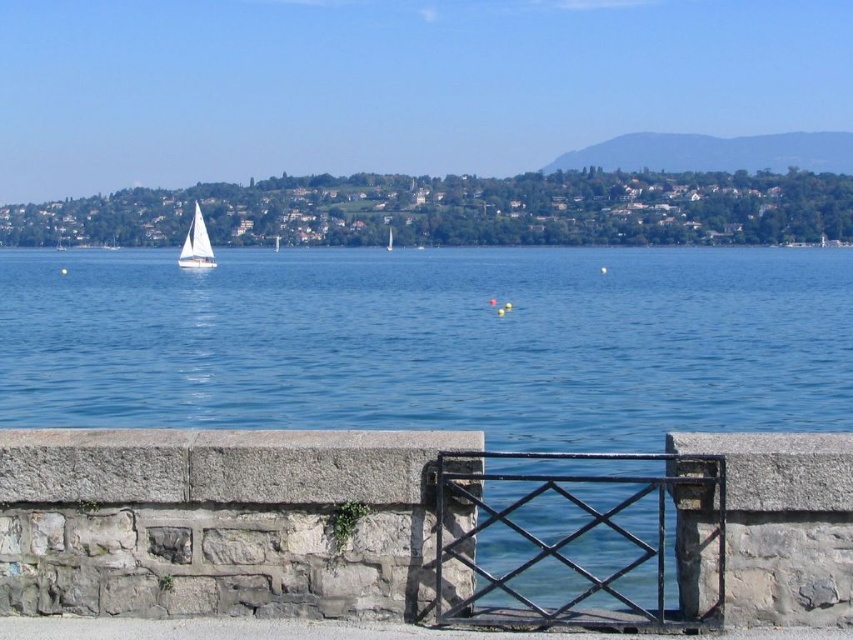
You are standing at the stone wall with the black wrought iron gate at center and want to walk towards the blue water at center. Which direction should you move relative to the gate?

The blue water at center is to the left of the black wrought iron gate at center, so you should move to the left of the gate to reach the water.

You are a painter setting up your easel to capture the lakeside scene. You want to paint both the black wrought iron gate at center and the white matte sailboat at center in the same painting. Which object should you place wider in your painting to maintain accuracy?

The black wrought iron gate at center should be painted wider because its actual width is larger than the white matte sailboat at center.